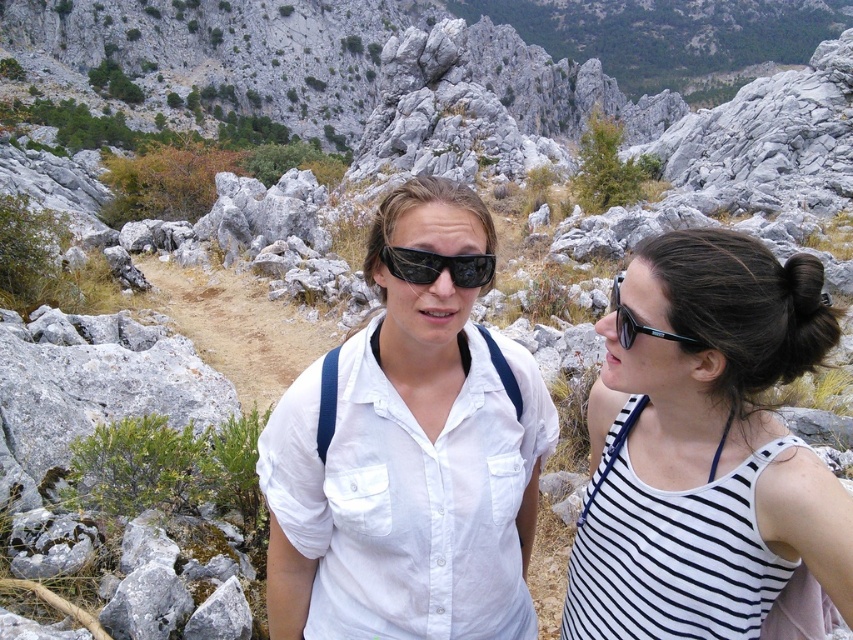
Question: Does white cotton shirt at center come behind black plastic sunglasses at center?

Choices:
 (A) yes
 (B) no

Answer: (B)

Question: Is black plastic sunglasses at center further to the viewer compared to black plastic sunglasses at right?

Choices:
 (A) no
 (B) yes

Answer: (B)

Question: Does white cotton shirt at center have a smaller size compared to white striped tank top at right?

Choices:
 (A) yes
 (B) no

Answer: (A)

Question: Which point is farther to the camera?

Choices:
 (A) (625, 316)
 (B) (596, 445)
 (C) (461, 259)
 (D) (535, 364)

Answer: (D)

Question: Which of the following is the farthest from the observer?

Choices:
 (A) (756, 545)
 (B) (630, 353)
 (C) (427, 273)
 (D) (624, 323)

Answer: (C)

Question: Among these objects, which one is farthest from the camera?

Choices:
 (A) black plastic sunglasses at right
 (B) white striped tank top at right
 (C) white cotton shirt at center

Answer: (A)